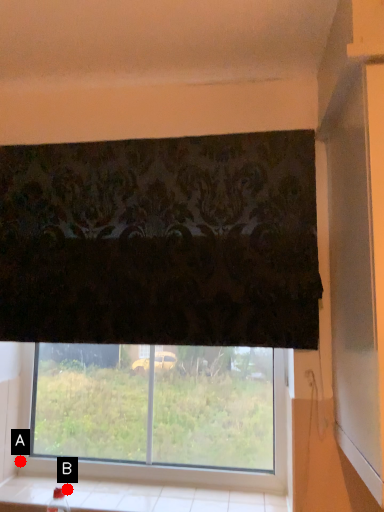
Question: Two points are circled on the image, labeled by A and B beside each circle. Which point is farther from the camera taking this photo?

Choices:
 (A) A is further
 (B) B is further

Answer: (A)